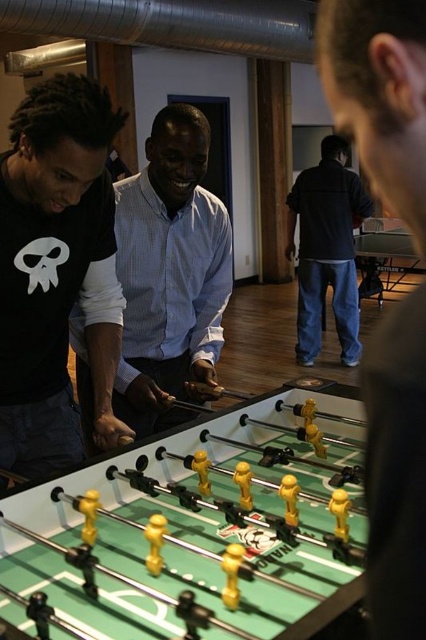
Question: Does black matte shirt at left appear on the right side of white striped shirt at center?

Choices:
 (A) yes
 (B) no

Answer: (B)

Question: Can you confirm if white striped shirt at center is positioned to the left of dark blue jeans at center?

Choices:
 (A) no
 (B) yes

Answer: (B)

Question: Which object is farther from the camera taking this photo?

Choices:
 (A) matte black shirt at center
 (B) dark blue jeans at center

Answer: (B)

Question: Does matte black shirt at center appear on the right side of white striped shirt at center?

Choices:
 (A) yes
 (B) no

Answer: (A)

Question: Which is nearer to the green plastic foosball table at center?

Choices:
 (A) black matte shirt at left
 (B) dark blue jeans at center
 (C) white striped shirt at center

Answer: (A)

Question: Which object is the farthest from the matte black shirt at center?

Choices:
 (A) dark blue jeans at center
 (B) black matte shirt at left

Answer: (A)